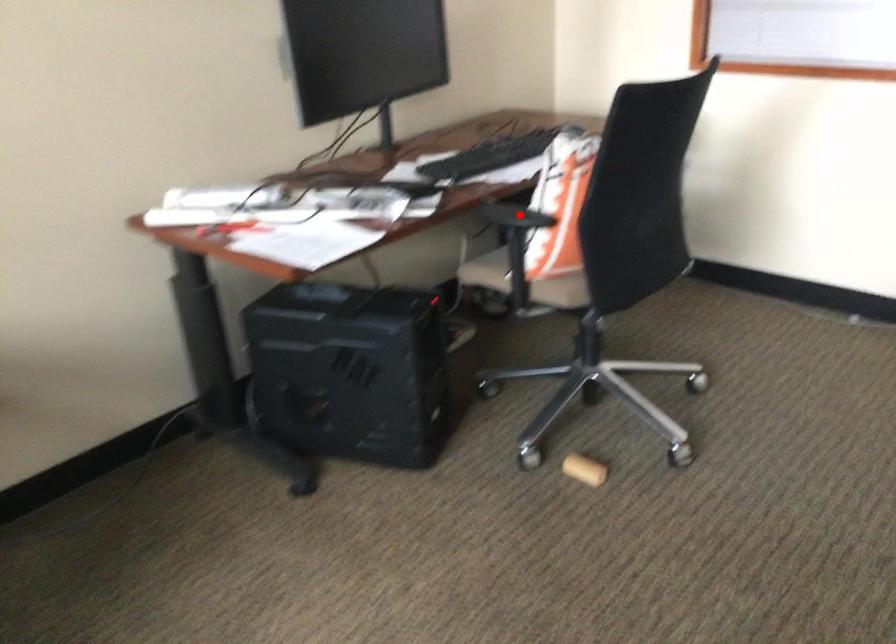
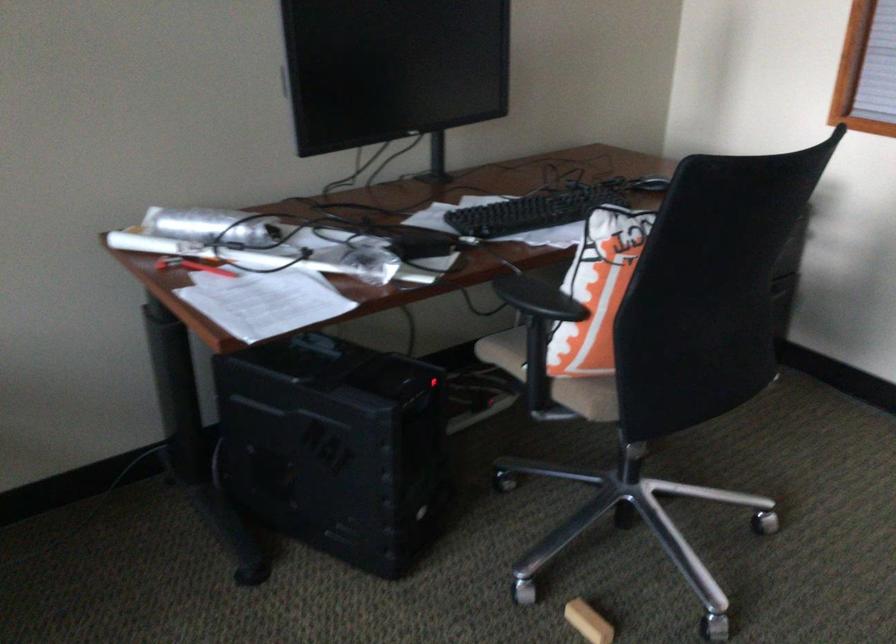
Question: I am providing you with two images of the same scene from different viewpoints. In image1, a red point is highlighted. Considering the same 3D point in image2, which of the following is correct?

Choices:
 (A) It is closer
 (B) It is farther

Answer: (A)